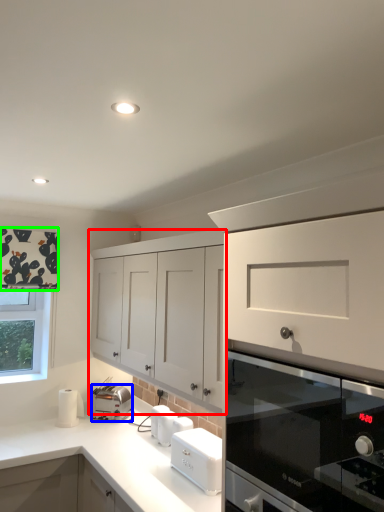
Question: Which is farther away from cabinetry (highlighted by a red box)? kitchen appliance (highlighted by a blue box) or curtain (highlighted by a green box)?

Choices:
 (A) kitchen appliance
 (B) curtain

Answer: (A)